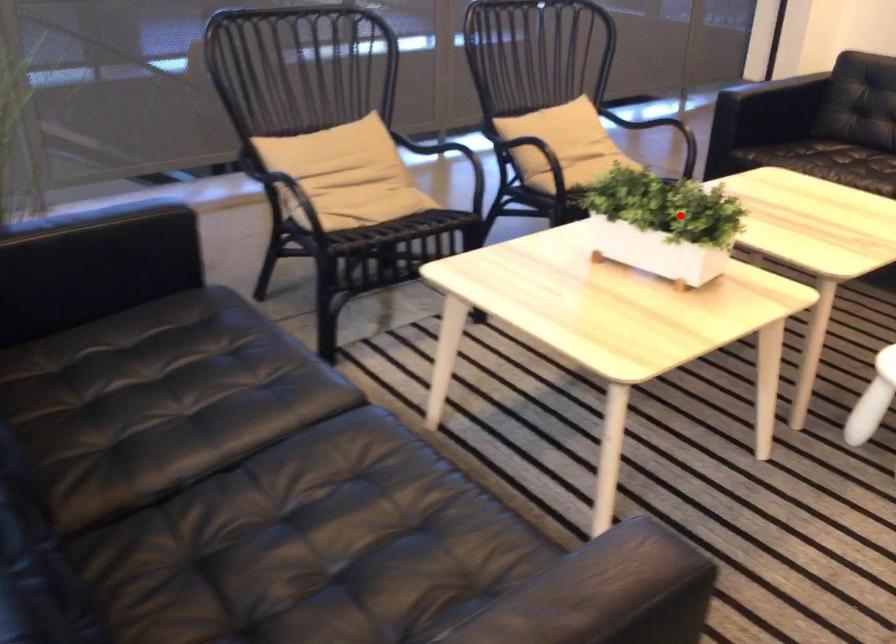
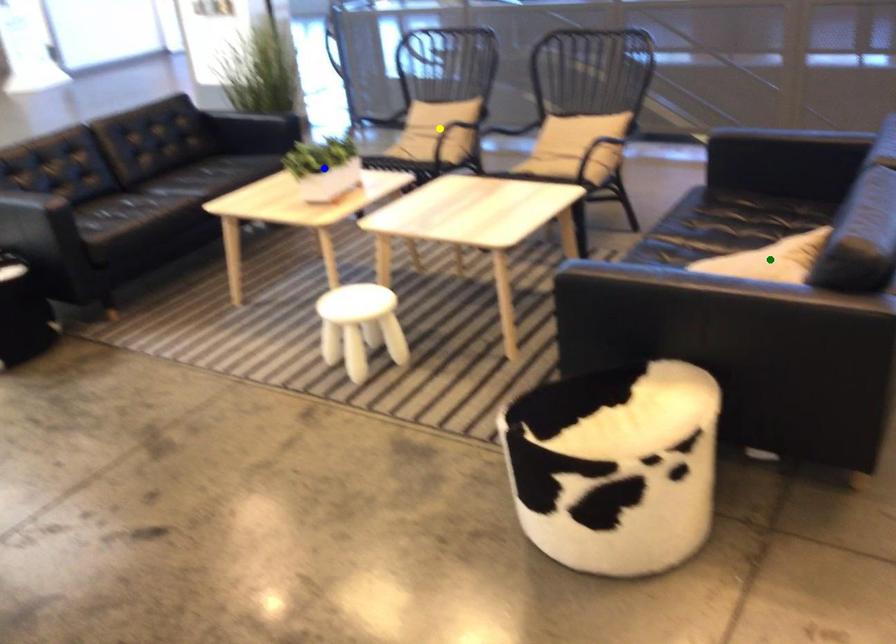
Question: I am providing you with two images of the same scene from different viewpoints. A red point is marked on the first image. You are given multiple points on the second image. Which spot in image 2 lines up with the point in image 1?

Choices:
 (A) green point
 (B) blue point
 (C) yellow point

Answer: (B)